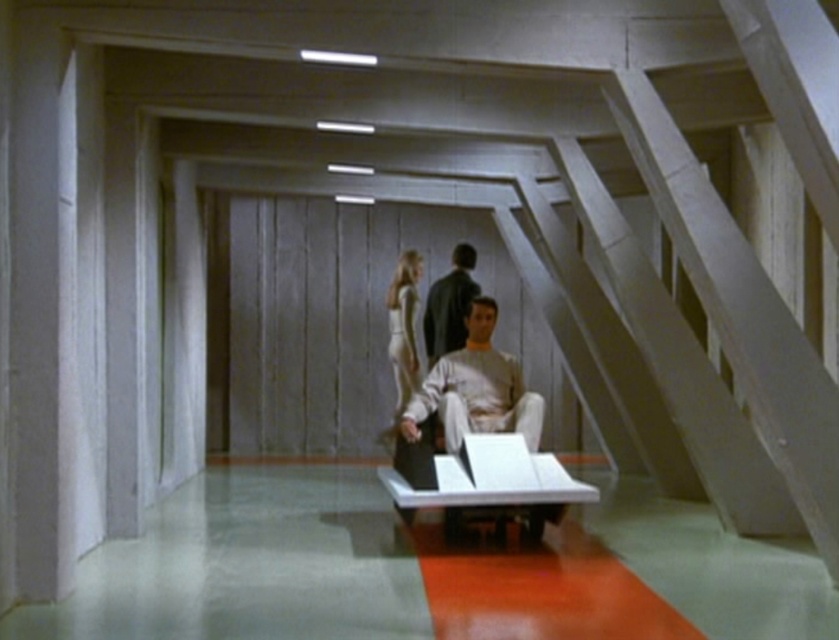
You are a costume designer preparing for a scene where two characters are seated side by side in the futuristic setting. The characters need to wear the dark brown leather jacket at center and the silvery metallic dress at center. Based on the description, which character should wear the shorter garment?

The character wearing the dark brown leather jacket at center should wear the shorter garment because the dark brown leather jacket at center is shorter than the silvery metallic dress at center.

You are navigating a futuristic room and need to place two markers at the coordinates point (470,280) and point (414,280). Which marker will be closer to your current position?

Point (470,280) is closer to the viewer than point (414,280), so the marker at point (470,280) will be closer to your current position.